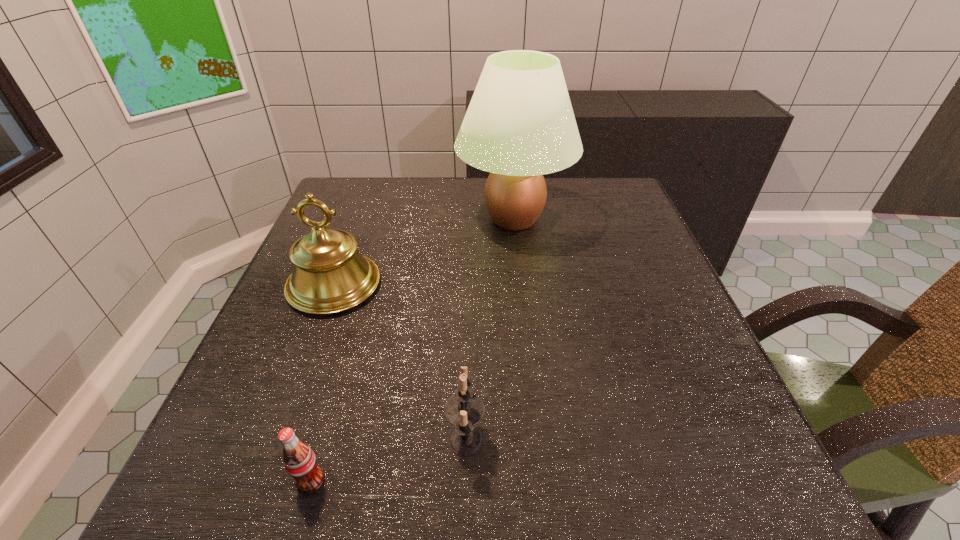
Identify the location of vacant point located 0.230m on the right of the third tallest object. The height and width of the screenshot is (540, 960). (633, 438).

Identify the location of vacant point located 0.250m on the right of the soda. [x=498, y=481].

You are a GUI agent. You are given a task and a screenshot of the screen. Output one action in this format:
    pyautogui.click(x=<x>, y=<y>)
    Task: Click on the object that is at the far edge
    This screenshot has width=960, height=540.
    Given the screenshot: What is the action you would take?
    pyautogui.click(x=520, y=125)

I want to click on candle holder present at the near edge, so click(463, 410).

Where is `soda at the near edge`? The image size is (960, 540). soda at the near edge is located at coordinates (299, 460).

Image resolution: width=960 pixels, height=540 pixels. Identify the location of bell that is at the left edge. (330, 275).

At what (x,y) coordinates should I click in order to perform the action: click on soda located in the left edge section of the desktop. Please return your answer as a coordinate pair (x, y). The height and width of the screenshot is (540, 960). Looking at the image, I should click on (299, 460).

Locate an element on the screen. object that is at the near left corner is located at coordinates (299, 460).

This screenshot has width=960, height=540. Find the location of `free location at the far edge of the desktop`. free location at the far edge of the desktop is located at coordinates (384, 219).

The image size is (960, 540). In the image, there is a desktop. What are the coordinates of `blank space at the near edge` in the screenshot? It's located at (563, 484).